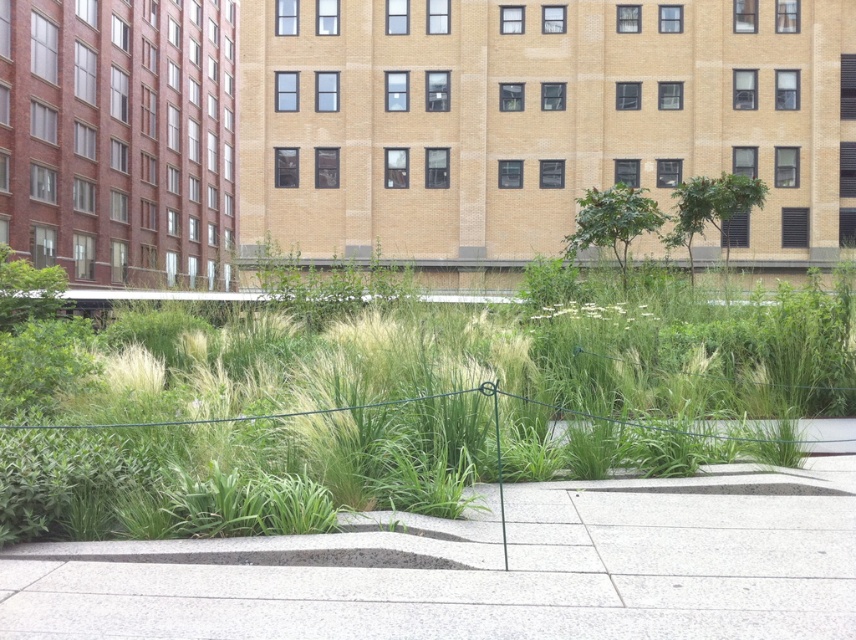
Question: Among these objects, which one is farthest from the camera?

Choices:
 (A) green grass at lower left
 (B) gray concrete pavement at center

Answer: (A)

Question: Does green grass at lower left have a larger size compared to gray concrete pavement at center?

Choices:
 (A) yes
 (B) no

Answer: (A)

Question: Which object appears closest to the camera in this image?

Choices:
 (A) green grass at lower left
 (B) gray concrete pavement at center

Answer: (B)

Question: Which object is farther from the camera taking this photo?

Choices:
 (A) green grass at lower left
 (B) gray concrete pavement at center

Answer: (A)

Question: Considering the relative positions of green grass at lower left and gray concrete pavement at center in the image provided, where is green grass at lower left located with respect to gray concrete pavement at center?

Choices:
 (A) above
 (B) below

Answer: (A)

Question: Does green grass at lower left appear on the right side of gray concrete pavement at center?

Choices:
 (A) yes
 (B) no

Answer: (B)